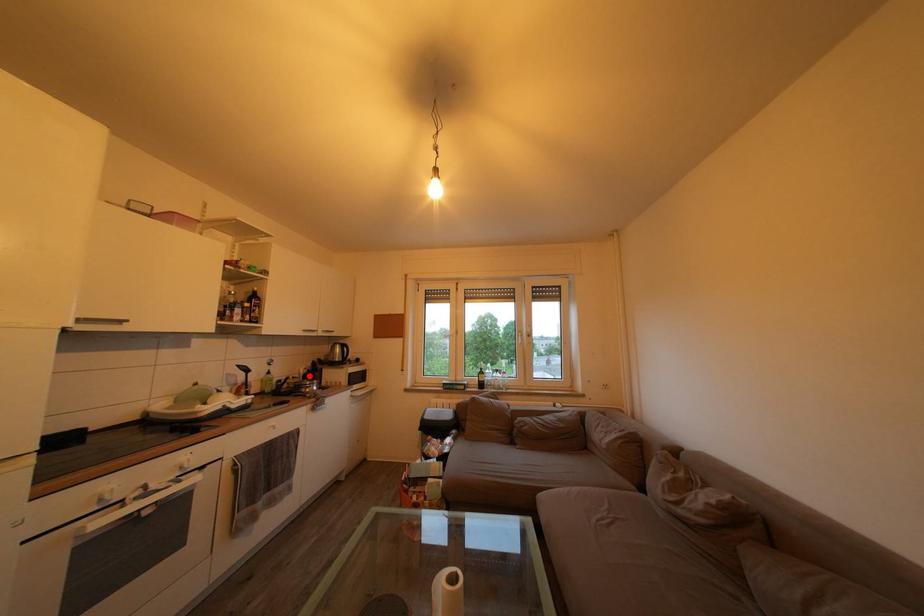
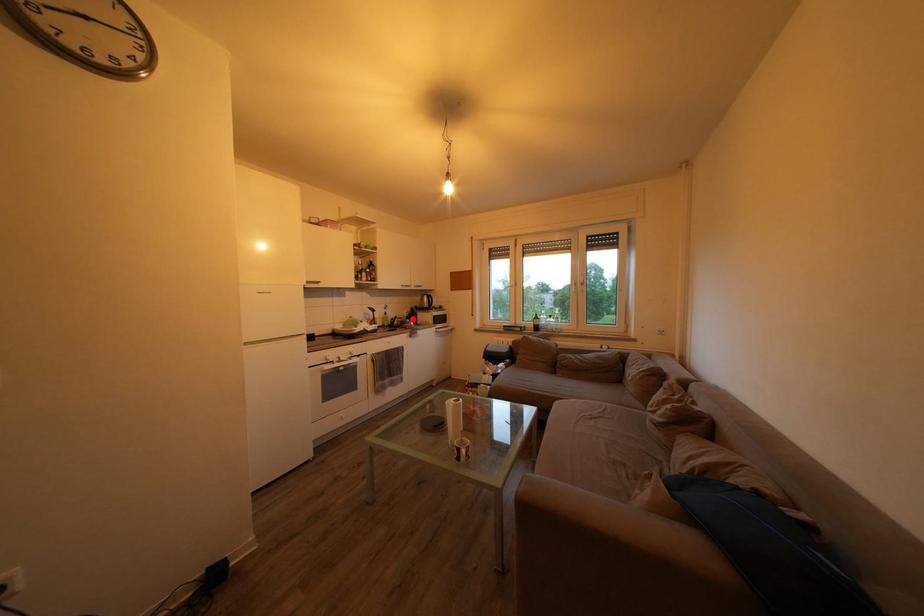
I am providing you with two images of the same scene from different viewpoints. A red point is marked on the first image and another point is marked on the second image. Does the point marked in image1 correspond to the same location as the one in image2?

Yes